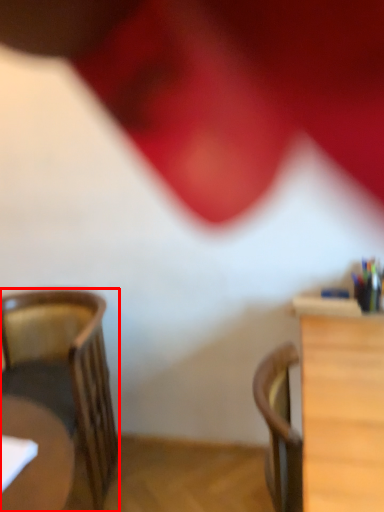
Question: From the image's perspective, where is chair (annotated by the red box) located relative to table?

Choices:
 (A) above
 (B) below

Answer: (A)